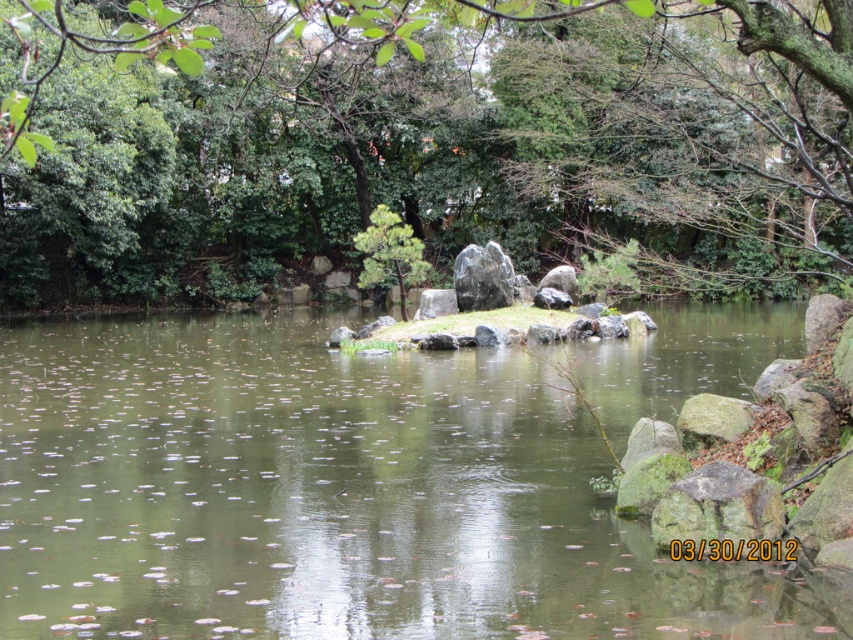
Question: Is green leafy tree at center in front of gray polished rock at center?

Choices:
 (A) no
 (B) yes

Answer: (B)

Question: Does green leafy tree at center come in front of rough textured rock at lower right?

Choices:
 (A) yes
 (B) no

Answer: (A)

Question: Is rough textured rock at lower right below gray polished rock at center?

Choices:
 (A) yes
 (B) no

Answer: (A)

Question: Among these points, which one is farthest from the camera?

Choices:
 (A) (743, 522)
 (B) (508, 611)
 (C) (496, 260)

Answer: (C)

Question: Among these objects, which one is nearest to the camera?

Choices:
 (A) green matte tree at center
 (B) green mossy rock at right
 (C) green leafy tree at center

Answer: (C)

Question: Estimate the real-world distances between objects in this image. Which object is farther from the green stone island at center?

Choices:
 (A) rough textured rock at lower right
 (B) green leafy tree at center
 (C) green matte tree at center
 (D) gray rock at center

Answer: (C)